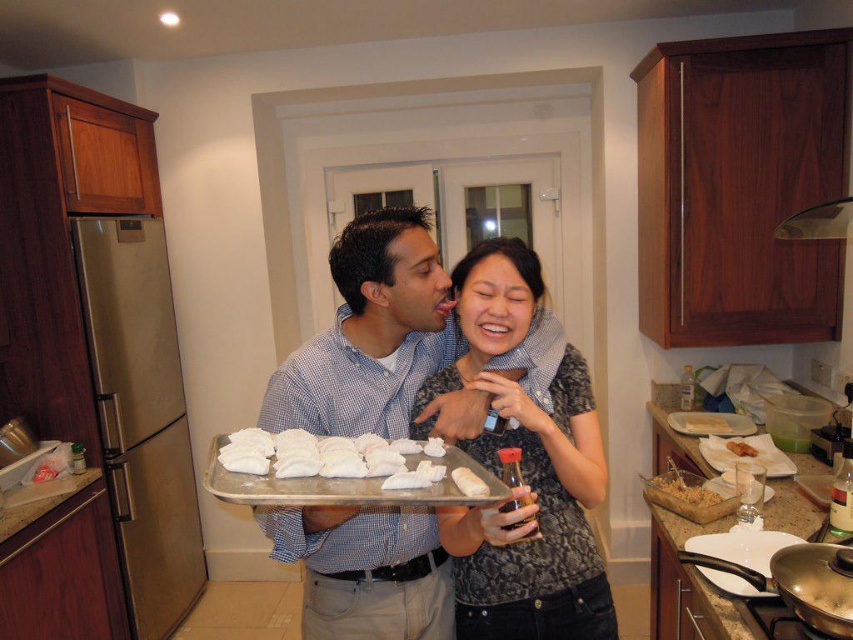
Does white matte bread at center have a larger size compared to brown crispy chicken at center?

Actually, white matte bread at center might be smaller than brown crispy chicken at center.

Who is lower down, white matte bread at center or brown crispy chicken at center?

brown crispy chicken at center is below.

Image resolution: width=853 pixels, height=640 pixels. I want to click on white matte bread at center, so click(469, 483).

Identify the location of white matte bread at center. This screenshot has height=640, width=853. (469, 483).

Is golden crispy rice at right shorter than white fluffy pastry at center?

Incorrect, golden crispy rice at right's height does not fall short of white fluffy pastry at center's.

Does golden crispy rice at right have a greater height compared to white fluffy pastry at center?

Yes, golden crispy rice at right is taller than white fluffy pastry at center.

What do you see at coordinates (683, 486) in the screenshot? I see `golden crispy rice at right` at bounding box center [683, 486].

At what (x,y) coordinates should I click in order to perform the action: click on golden crispy rice at right. Please return your answer as a coordinate pair (x, y). Looking at the image, I should click on (683, 486).

Is point (440, 385) farther from viewer compared to point (706, 433)?

No, it is in front of (706, 433).

Which is behind, point (514, 412) or point (698, 417)?

The point (698, 417) is behind.

Where is `patterned fabric shirt at center`? This screenshot has height=640, width=853. patterned fabric shirt at center is located at coordinates (524, 468).